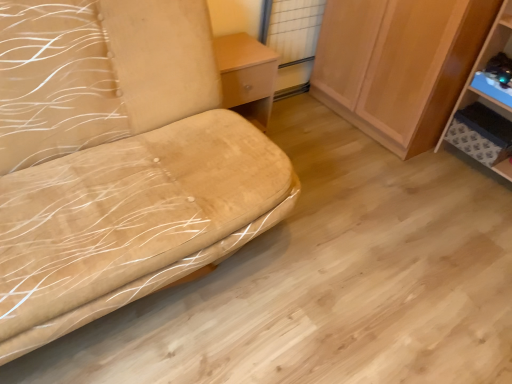
Find the location of a particular element. The image size is (512, 384). free space to the left of wooden cabinet at right is located at coordinates (305, 124).